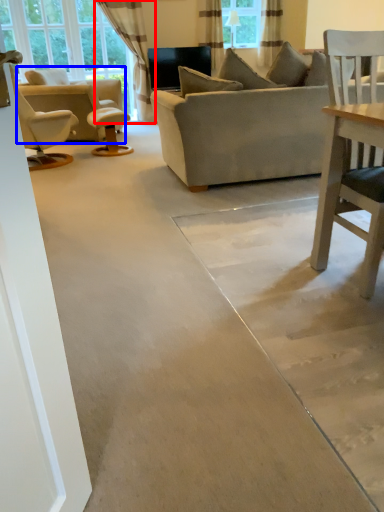
Question: Which object is closer to the camera taking this photo, curtain (highlighted by a red box) or chair (highlighted by a blue box)?

Choices:
 (A) curtain
 (B) chair

Answer: (B)